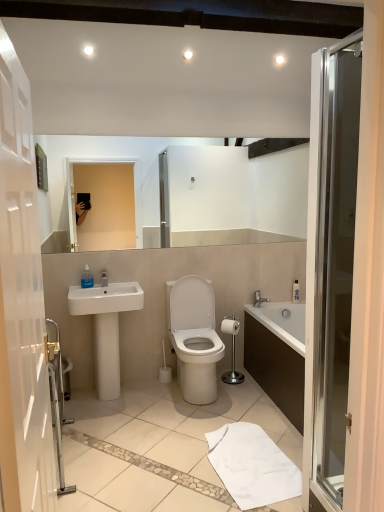
Question: From the image's perspective, is translucent plastic soap dispenser at sink, which is counted as the first toiletry, starting from the top, above or below white matte toilet paper at center?

Choices:
 (A) above
 (B) below

Answer: (A)

Question: Is translucent plastic soap dispenser at sink, the 2th toiletry in the right-to-left sequence, taller or shorter than white matte toilet paper at center?

Choices:
 (A) short
 (B) tall

Answer: (B)

Question: Based on their relative distances, which object is farther from the white glossy sink at lower left?

Choices:
 (A) white glossy toilet at center
 (B) silver metallic faucet at lower right
 (C) white matte toilet paper at center
 (D) white cotton bath towel at lower center
 (E) polished chrome toilet paper holder at center

Answer: (B)

Question: Estimate the real-world distances between objects in this image. Which object is closer to the white glossy toilet at center?

Choices:
 (A) white matte toilet paper at center
 (B) white cotton bath towel at lower center
 (C) polished chrome toilet paper holder at center
 (D) white glossy sink at lower left
 (E) white plastic bottle at upper right, marked as the 2th toiletry in a left-to-right arrangement

Answer: (C)